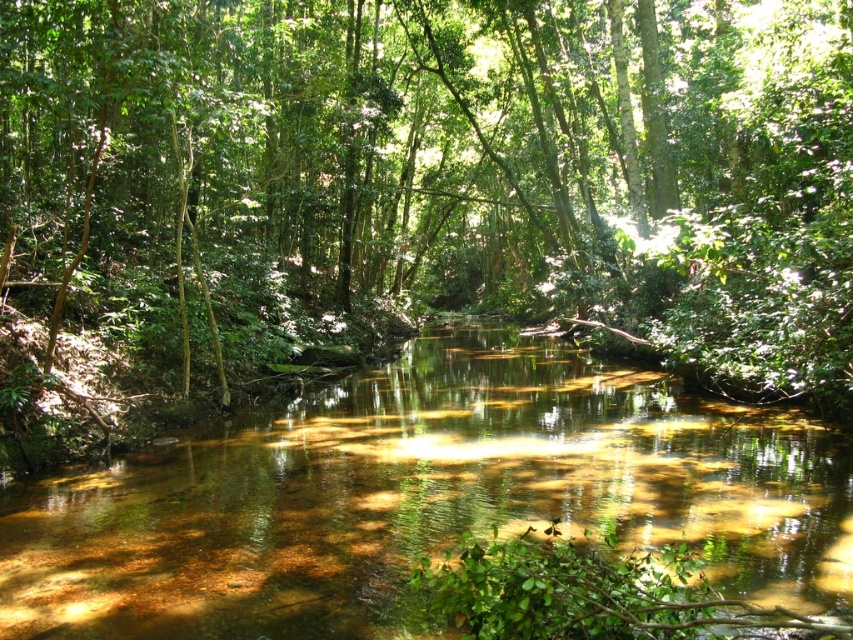
Question: Is green leafy tree at center closer to camera compared to translucent brown water at center?

Choices:
 (A) no
 (B) yes

Answer: (A)

Question: Which object is farther from the camera taking this photo?

Choices:
 (A) translucent brown water at center
 (B) green leafy tree at center

Answer: (B)

Question: From the image, what is the correct spatial relationship of green leafy tree at center in relation to translucent brown water at center?

Choices:
 (A) left
 (B) right

Answer: (B)

Question: Which point is closer to the camera?

Choices:
 (A) (369, 515)
 (B) (306, 92)

Answer: (A)

Question: Is green leafy tree at center wider than translucent brown water at center?

Choices:
 (A) yes
 (B) no

Answer: (A)